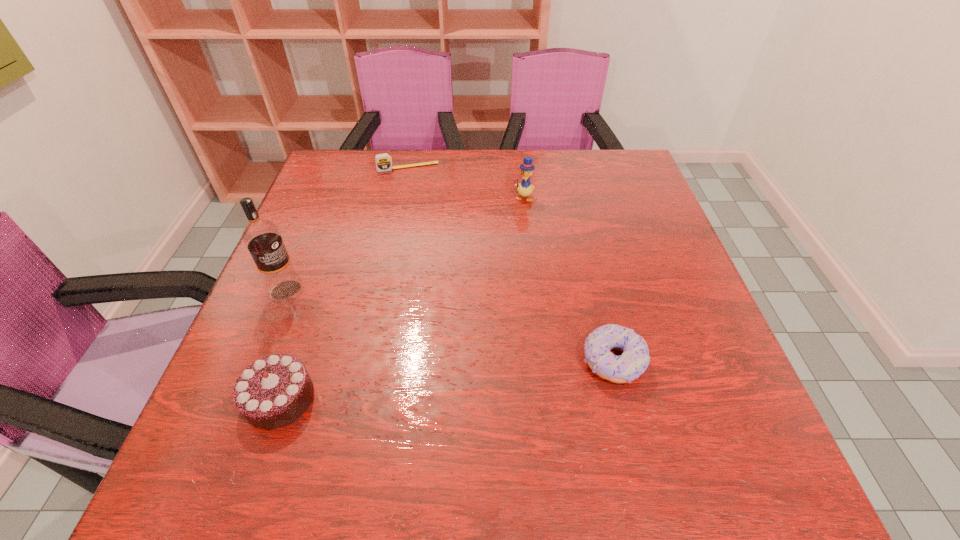
You are a GUI agent. You are given a task and a screenshot of the screen. Output one action in this format:
    pyautogui.click(x=<x>, y=<y>)
    Task: Click on the vacant space on the desktop that is between the chocolate cake and the doughnut and is positioned on the face of the fourth shortest object, where the monocle is placed
    The image size is (960, 540).
    Given the screenshot: What is the action you would take?
    (x=467, y=377)

Locate an element on the screen. Image resolution: width=960 pixels, height=540 pixels. free spot on the desktop that is between the chocolate cake and the rightmost object and is positioned on the label of the third farthest object is located at coordinates (411, 383).

Where is `vacant space on the desktop that is between the third tallest object and the doughnut and is positioned at the front of the tape measure with the tape extended`? The width and height of the screenshot is (960, 540). vacant space on the desktop that is between the third tallest object and the doughnut and is positioned at the front of the tape measure with the tape extended is located at coordinates (458, 378).